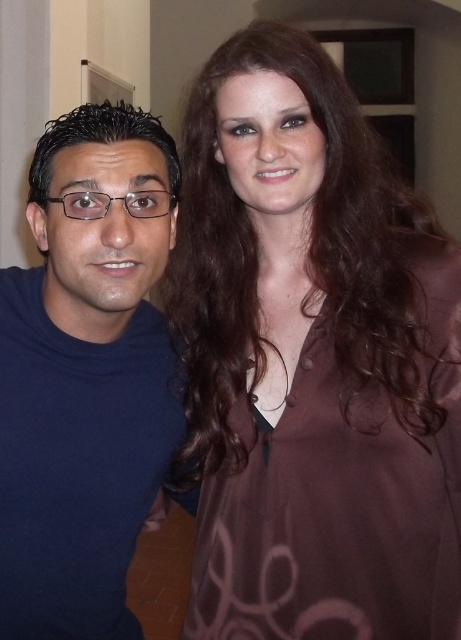
Question: Can you confirm if brown satin blouse at upper right is positioned below matte blue shirt at left?

Choices:
 (A) no
 (B) yes

Answer: (A)

Question: Is brown satin blouse at upper right positioned at the back of matte blue shirt at left?

Choices:
 (A) yes
 (B) no

Answer: (B)

Question: Is brown satin blouse at upper right further to the viewer compared to matte blue shirt at left?

Choices:
 (A) yes
 (B) no

Answer: (B)

Question: Which point is farther from the camera taking this photo?

Choices:
 (A) (29, 513)
 (B) (244, 29)

Answer: (A)

Question: Among these points, which one is farthest from the camera?

Choices:
 (A) (33, 349)
 (B) (287, 96)

Answer: (A)